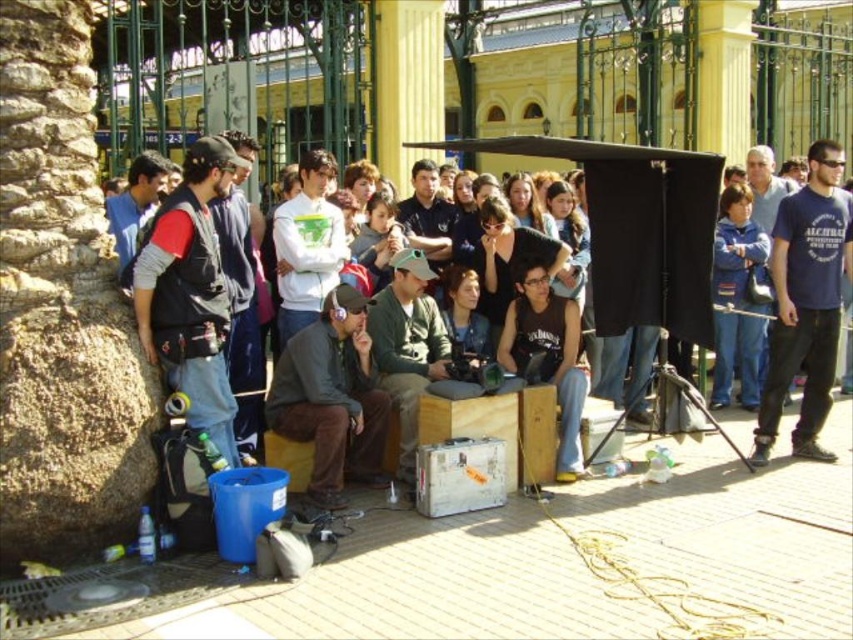
What do you see at coordinates (306, 244) in the screenshot?
I see `white matte hoodie at center` at bounding box center [306, 244].

Which is behind, point (311, 225) or point (758, 157)?

Positioned behind is point (758, 157).

Which is behind, point (302, 316) or point (766, 204)?

Point (766, 204)

Image resolution: width=853 pixels, height=640 pixels. I want to click on white matte hoodie at center, so click(306, 244).

Can you confirm if black matte tank top at center is positioned below white matte hoodie at center?

Correct, black matte tank top at center is located below white matte hoodie at center.

From the picture: Can you confirm if black matte tank top at center is smaller than white matte hoodie at center?

Yes, black matte tank top at center is smaller than white matte hoodie at center.

Between point (563, 422) and point (312, 230), which one is positioned in front?

Point (563, 422) is in front.

Identify the location of black matte tank top at center. (548, 356).

Can you confirm if black matte vest at left is positioned to the left of black matte tank top at center?

Correct, you'll find black matte vest at left to the left of black matte tank top at center.

At what (x,y) coordinates should I click in order to perform the action: click on black matte vest at left. Please return your answer as a coordinate pair (x, y). The height and width of the screenshot is (640, 853). Looking at the image, I should click on coord(190,294).

This screenshot has width=853, height=640. I want to click on black matte vest at left, so click(190, 294).